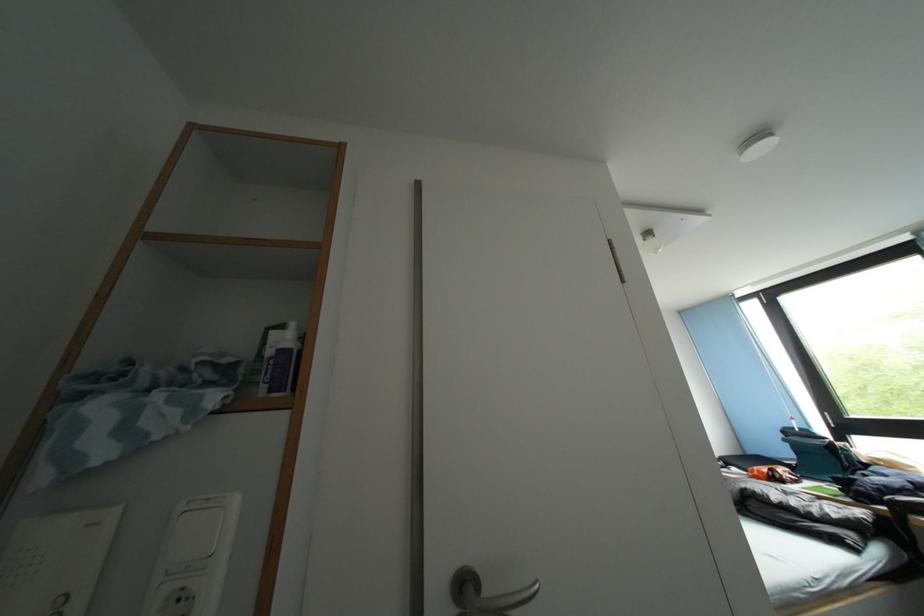
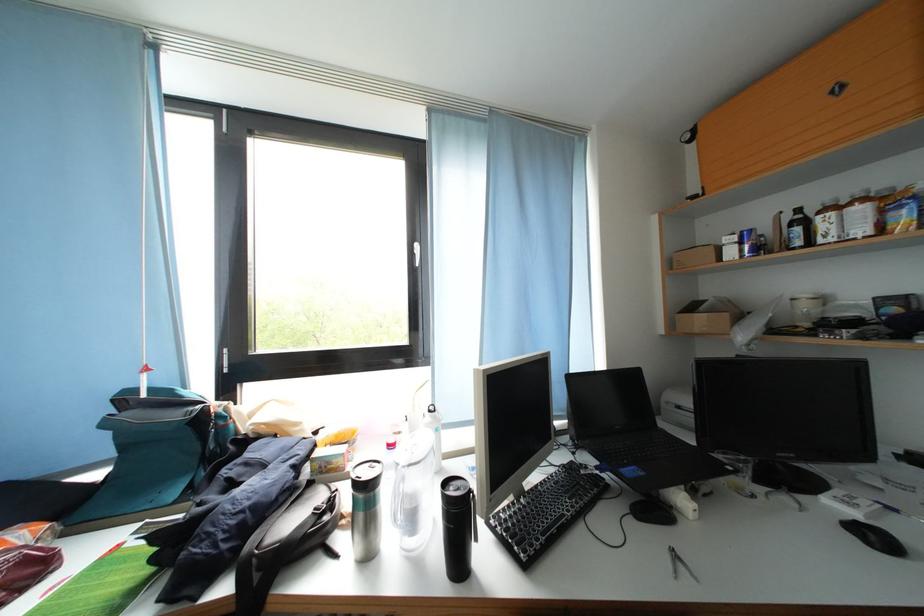
In the second image, find the point that corresponds to (794,446) in the first image.

(114, 429)